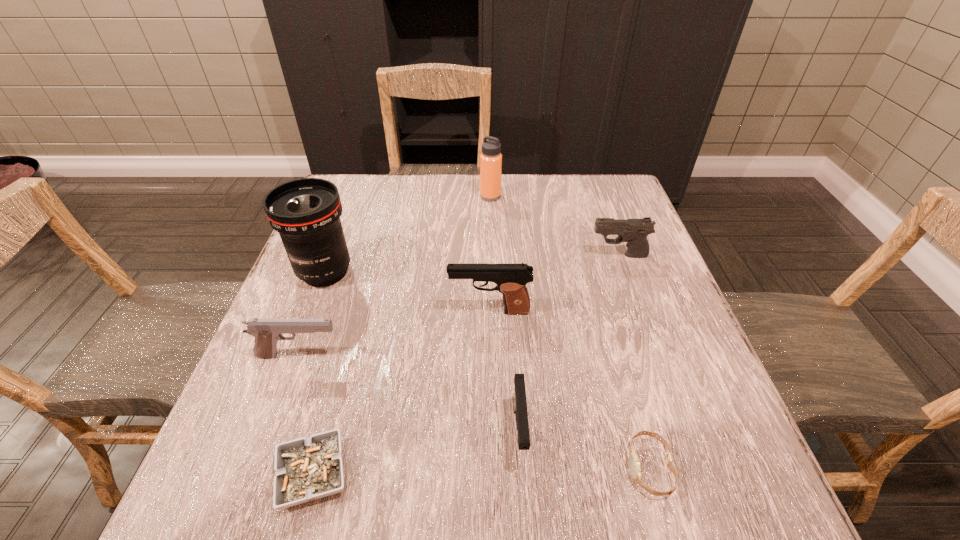
The height and width of the screenshot is (540, 960). I want to click on vacant space at the far left corner, so click(376, 217).

Locate an element on the screen. Image resolution: width=960 pixels, height=540 pixels. vacant space at the far right corner is located at coordinates (592, 210).

Where is `free spot between the ashtray and the tallest pistol`? free spot between the ashtray and the tallest pistol is located at coordinates (401, 393).

The image size is (960, 540). In order to click on unoccupied area between the telephoto lens and the farthest pistol in this screenshot , I will do (471, 264).

Where is `free space between the nearest pistol and the farthest pistol`? This screenshot has height=540, width=960. free space between the nearest pistol and the farthest pistol is located at coordinates pos(568,343).

Locate an element on the screen. The width and height of the screenshot is (960, 540). vacant area between the thermos bottle and the leftmost pistol is located at coordinates (395, 276).

This screenshot has height=540, width=960. Identify the location of free space between the shortest pistol and the second shortest object. (584, 449).

Where is `vacant point located between the shortest object and the third shortest object`? vacant point located between the shortest object and the third shortest object is located at coordinates (416, 453).

Where is `vacant area between the second nearest pistol and the sixth tallest object`? vacant area between the second nearest pistol and the sixth tallest object is located at coordinates (409, 393).

Identify the location of vacant area that lies between the sixth shortest object and the third shortest object. coord(504,371).